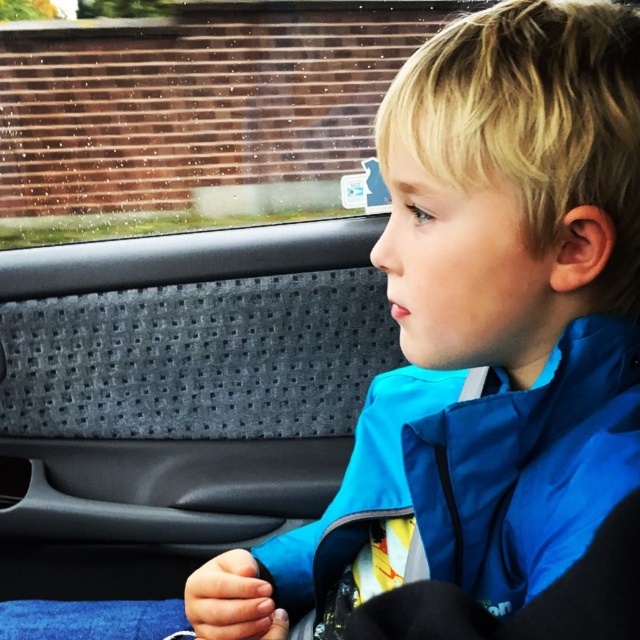
Question: Which point is farther to the camera?

Choices:
 (A) blue fabric jacket at center
 (B) transparent glass window at upper left

Answer: (B)

Question: Is transparent glass window at upper left bigger than blue fabric jacket at center?

Choices:
 (A) yes
 (B) no

Answer: (A)

Question: Which object appears closest to the camera in this image?

Choices:
 (A) transparent glass window at upper left
 (B) blue fabric jacket at center

Answer: (B)

Question: Does transparent glass window at upper left have a smaller size compared to blue fabric jacket at center?

Choices:
 (A) no
 (B) yes

Answer: (A)

Question: Which object appears farthest from the camera in this image?

Choices:
 (A) blue fabric jacket at center
 (B) transparent glass window at upper left

Answer: (B)

Question: Can you confirm if transparent glass window at upper left is bigger than blue fabric jacket at center?

Choices:
 (A) yes
 (B) no

Answer: (A)